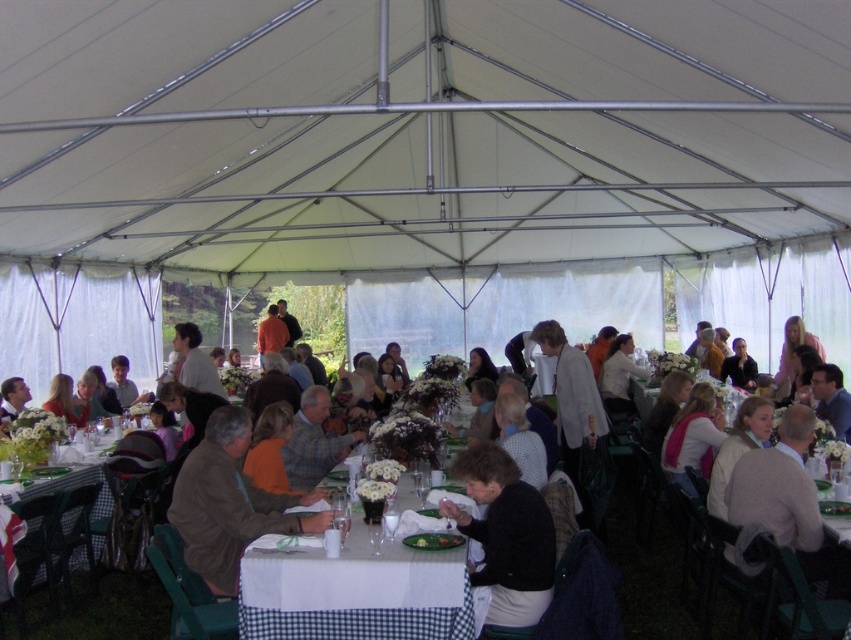
Based on the photo, you are a guest at the event and need to retrieve your jacket from the brown leather jacket at center. You are currently standing at the white checkered tablecloth at lower left. Can you reach the jacket without moving more than 1.5 meters?

The distance between the brown leather jacket at center and the white checkered tablecloth at lower left is 1.48 meters, so yes, you can reach the jacket without moving more than 1.5 meters.